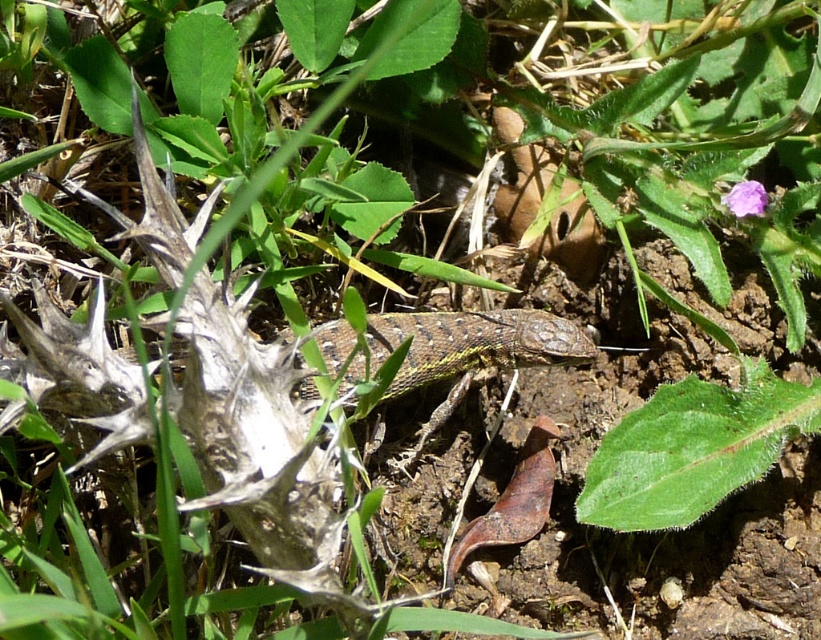
Who is positioned more to the right, green scaly lizard at center or purple matte flower at upper right?

purple matte flower at upper right is more to the right.

Does green scaly lizard at center have a lesser height compared to purple matte flower at upper right?

No, green scaly lizard at center is not shorter than purple matte flower at upper right.

Is point (503, 358) positioned behind point (760, 196)?

No, (503, 358) is in front of (760, 196).

At what (x,y) coordinates should I click in order to perform the action: click on green scaly lizard at center. Please return your answer as a coordinate pair (x, y). Looking at the image, I should click on (468, 352).